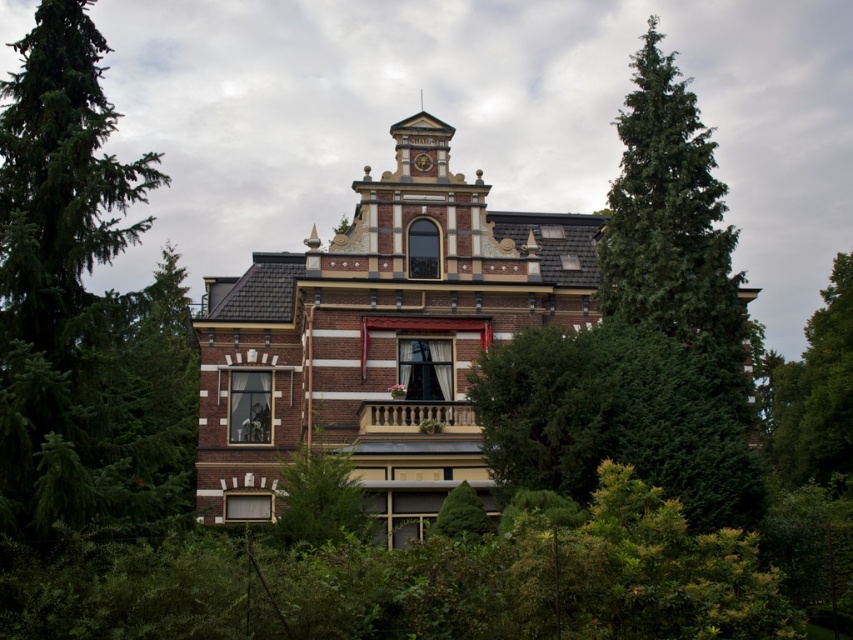
Can you confirm if brown brick tower at center is shorter than green evergreen tree at left?

Yes.

Between brown brick tower at center and green evergreen tree at left, which one is positioned lower?

brown brick tower at center

Between point (209, 376) and point (19, 534), which one is positioned behind?

Point (209, 376)

Find the location of `brown brick tower at center`. brown brick tower at center is located at coordinates (378, 333).

Is point (200, 349) positioned in front of point (781, 445)?

That is True.

Can you confirm if brown brick tower at center is wider than green leafy tree at right?

Yes.

Is point (438, 365) less distant than point (840, 401)?

Yes, point (438, 365) is closer to viewer.

You are a GUI agent. You are given a task and a screenshot of the screen. Output one action in this format:
    pyautogui.click(x=<x>, y=<y>)
    Task: Click on the brown brick tower at center
    The image size is (853, 640).
    Given the screenshot: What is the action you would take?
    pyautogui.click(x=378, y=333)

Is green evergreen tree at left behind green leafy tree at right?

No, green evergreen tree at left is closer to the viewer.

What do you see at coordinates (80, 307) in the screenshot?
I see `green evergreen tree at left` at bounding box center [80, 307].

In order to click on green evergreen tree at left in this screenshot , I will do `click(80, 307)`.